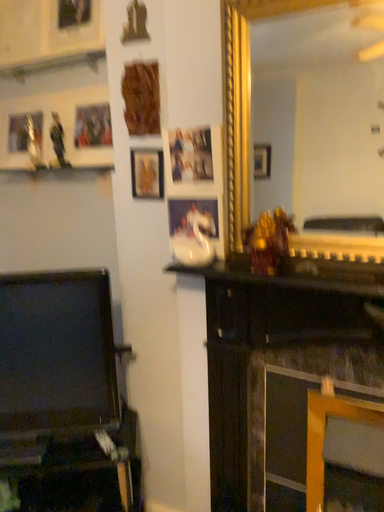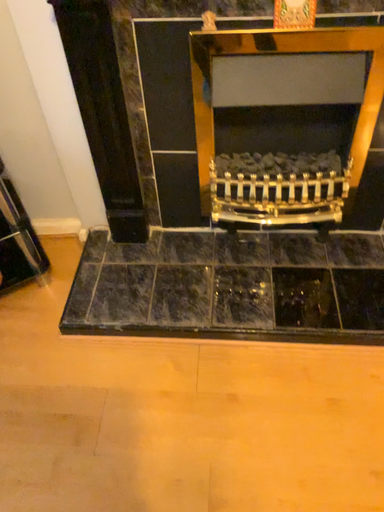
Question: Which way did the camera rotate in the video?

Choices:
 (A) rotated downward
 (B) rotated upward

Answer: (A)